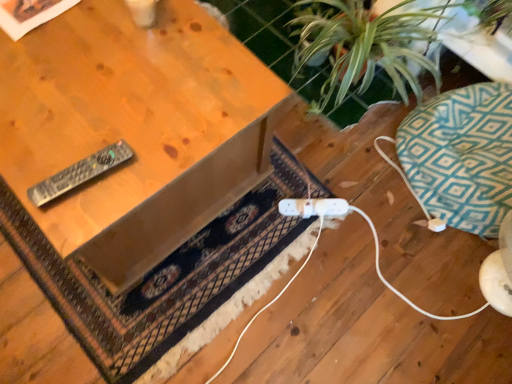
Identify the location of free spot to the left of teal geometric cushion at right. (344, 201).